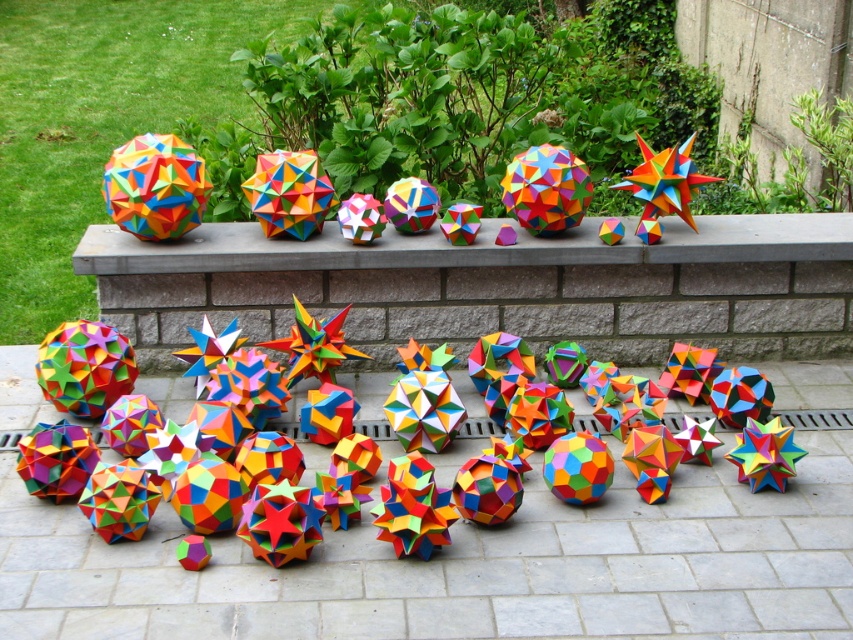
Which is more to the right, matte colorful origami at upper center or multicolored paper at center?

matte colorful origami at upper center is more to the right.

Does matte colorful origami at upper center have a lesser height compared to multicolored paper at center?

In fact, matte colorful origami at upper center may be taller than multicolored paper at center.

Between point (273, 320) and point (663, 228), which one is positioned in front?

Point (273, 320) is in front.

The width and height of the screenshot is (853, 640). In order to click on matte colorful origami at upper center in this screenshot , I will do `click(496, 285)`.